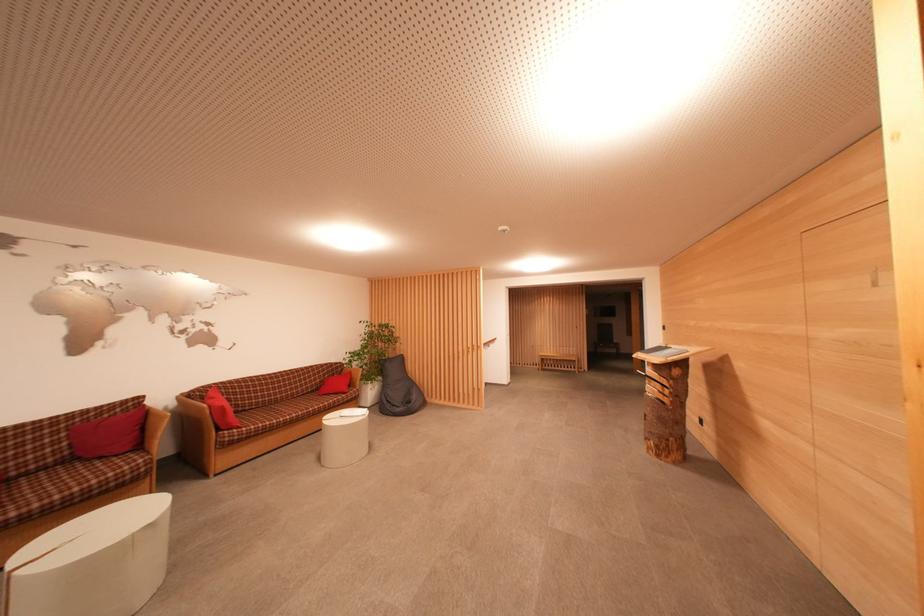
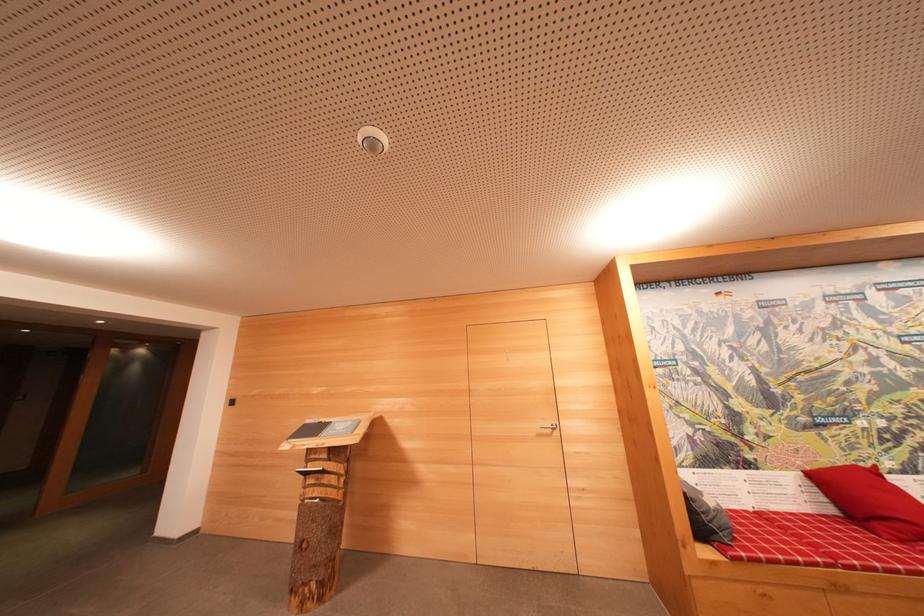
Find the pixel in the second image that matches (663,357) in the first image.

(330, 436)